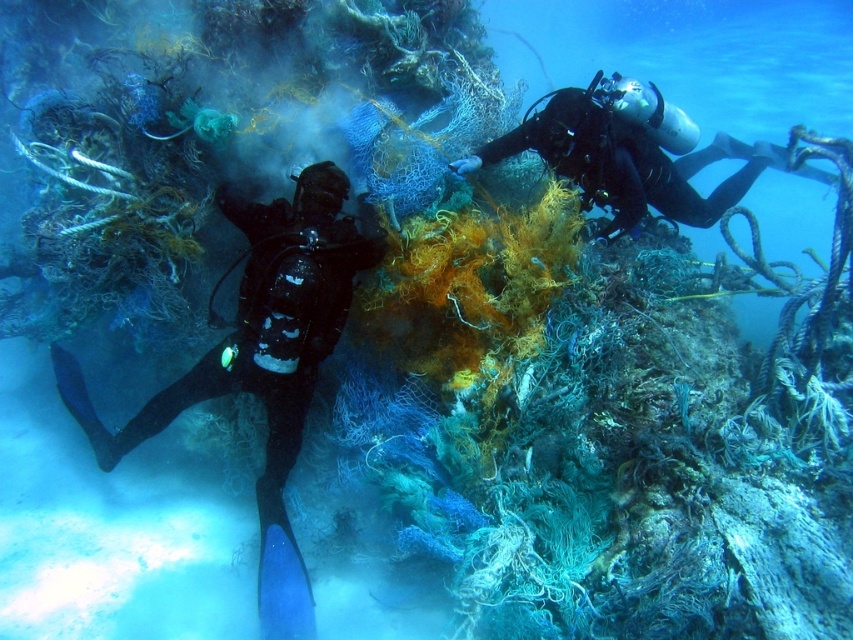
You are a marine biologist observing the underwater scene. You notice two points marked in the image. Which point is closer to you, point (331,275) or point (656,205)?

Point (331,275) is closer to the viewer than point (656,205).

You are a marine biologist observing the underwater scene. You need to determine which scuba diver is smaller in width between the black matte scuba diver at left and the black matte scuba diver at upper right. Which one is smaller?

The black matte scuba diver at left is smaller in width than the black matte scuba diver at upper right.